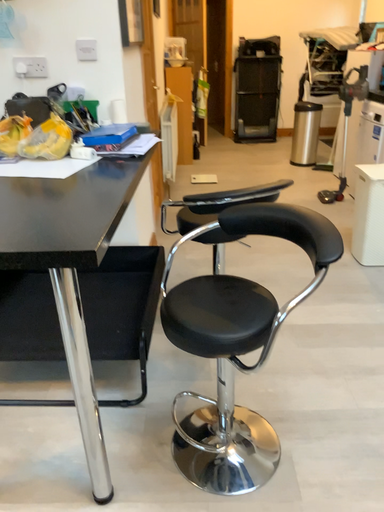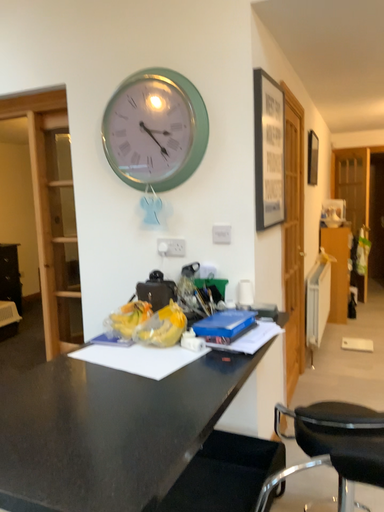
Question: Which way did the camera rotate in the video?

Choices:
 (A) rotated left
 (B) rotated right

Answer: (A)